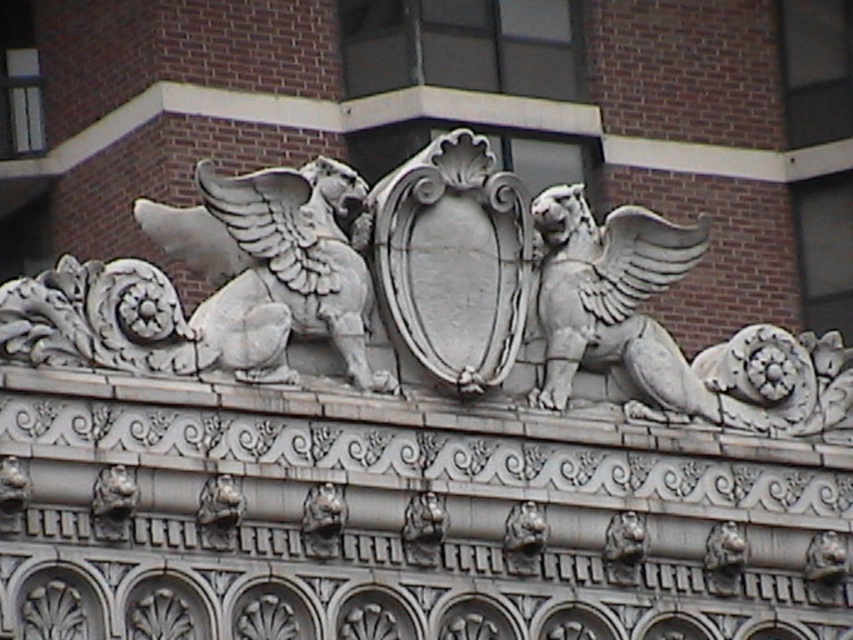
Who is positioned more to the left, white stone gryphon at right or white stone winged lion at upper left?

white stone winged lion at upper left is more to the left.

Is the position of white stone gryphon at right less distant than that of white stone winged lion at upper left?

Result: No.

Is point (811, 380) farther from viewer compared to point (296, 196)?

Yes, it is behind point (296, 196).

Find the location of a particular element. white stone gryphon at right is located at coordinates (665, 330).